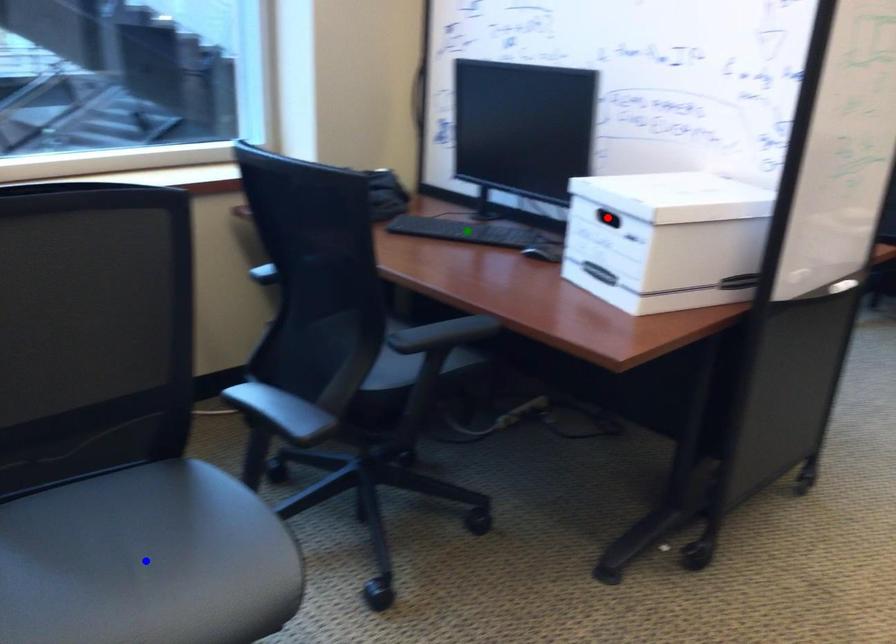
Order these from nearest to farthest:
red point, blue point, green point

blue point → red point → green point